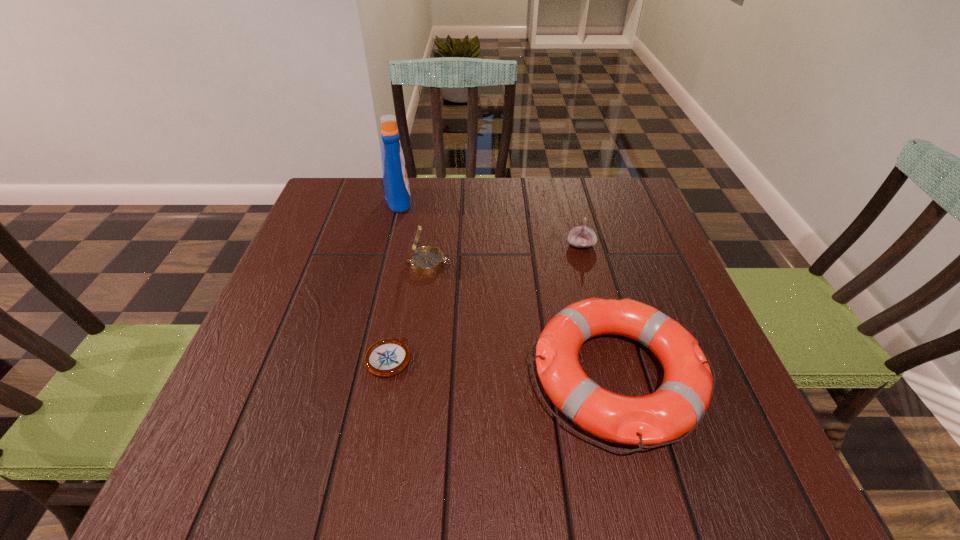
At what (x,y) coordinates should I click in order to perform the action: click on vacant space located 0.170m on the back of the garlic. Please return your answer as a coordinate pair (x, y). Looking at the image, I should click on (568, 199).

The height and width of the screenshot is (540, 960). What are the coordinates of `vacant space located on the left of the life buoy` in the screenshot? It's located at [x=372, y=375].

Locate an element on the screen. The height and width of the screenshot is (540, 960). vacant area located on the right of the shorter compass is located at coordinates (481, 358).

Locate an element on the screen. object present at the far edge is located at coordinates (396, 185).

At what (x,y) coordinates should I click in order to perform the action: click on object situated at the near edge. Please return your answer as a coordinate pair (x, y). The image size is (960, 540). Looking at the image, I should click on (678, 406).

I want to click on object that is at the right edge, so click(x=678, y=406).

You are a GUI agent. You are given a task and a screenshot of the screen. Output one action in this format:
    pyautogui.click(x=<x>, y=<y>)
    Task: Click on the object at the near right corner
    The height and width of the screenshot is (540, 960).
    Given the screenshot: What is the action you would take?
    pyautogui.click(x=678, y=406)

At what (x,y) coordinates should I click in order to perform the action: click on free point at the far edge. Please return your answer as a coordinate pair (x, y). Image resolution: width=960 pixels, height=540 pixels. Looking at the image, I should click on (391, 209).

Locate an element on the screen. Image resolution: width=960 pixels, height=540 pixels. vacant area at the near edge is located at coordinates (643, 492).

The image size is (960, 540). Find the location of `free spot at the left edge of the desktop`. free spot at the left edge of the desktop is located at coordinates (350, 255).